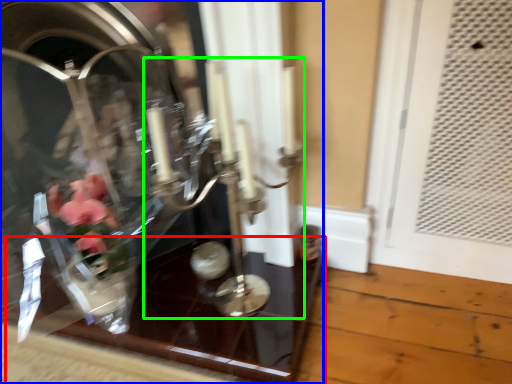
Question: Considering the real-world distances, which object is farthest from glass table (highlighted by a red box)? glass box (highlighted by a blue box) or candle holder (highlighted by a green box)?

Choices:
 (A) glass box
 (B) candle holder

Answer: (B)